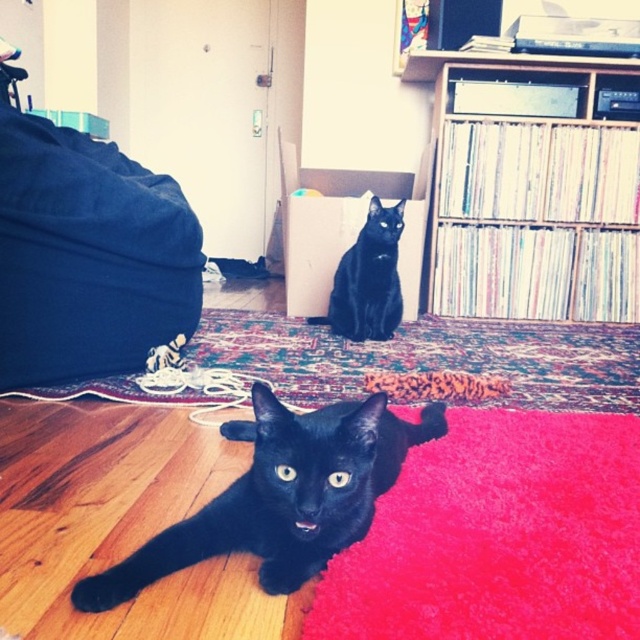
Question: Can you confirm if shiny black cat at lower left is thinner than carpeted rug at center?

Choices:
 (A) yes
 (B) no

Answer: (A)

Question: Which object appears farthest from the camera in this image?

Choices:
 (A) wooden vinyl records at upper right
 (B) velvety pink rug at lower center
 (C) shiny black cat at lower left

Answer: (A)

Question: Which object is farther from the camera taking this photo?

Choices:
 (A) blue fabric bag at left
 (B) shiny black cat at lower left

Answer: (A)

Question: Among these objects, which one is nearest to the camera?

Choices:
 (A) blue fabric bag at left
 (B) carpeted rug at center

Answer: (A)

Question: Is blue fabric bag at left behind carpeted rug at center?

Choices:
 (A) yes
 (B) no

Answer: (B)

Question: Does wooden vinyl records at upper right appear on the right side of shiny black cat at lower left?

Choices:
 (A) no
 (B) yes

Answer: (B)